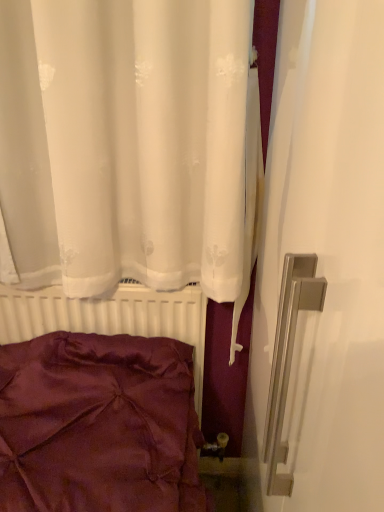
You are a GUI agent. You are given a task and a screenshot of the screen. Output one action in this format:
    pyautogui.click(x=<x>, y=<y>)
    Task: Click on the satin burgundy pillow at lower left
    The height and width of the screenshot is (512, 384).
    Given the screenshot: What is the action you would take?
    pyautogui.click(x=98, y=425)

Describe the element at coordinates (98, 425) in the screenshot. Image resolution: width=384 pixels, height=512 pixels. I see `satin burgundy pillow at lower left` at that location.

In order to face white matte radiator at lower left, should I rotate leftwards or rightwards?

It's best to rotate left around 10.101 degrees.

At what (x,y) coordinates should I click in order to perform the action: click on white matte radiator at lower left. Please return your answer as a coordinate pair (x, y). Image resolution: width=384 pixels, height=512 pixels. Looking at the image, I should click on [x=110, y=317].

What do you see at coordinates (110, 317) in the screenshot? Image resolution: width=384 pixels, height=512 pixels. I see `white matte radiator at lower left` at bounding box center [110, 317].

Image resolution: width=384 pixels, height=512 pixels. I want to click on satin burgundy pillow at lower left, so click(x=98, y=425).

Which is more to the right, white matte radiator at lower left or satin burgundy pillow at lower left?

Positioned to the right is white matte radiator at lower left.

Does white matte radiator at lower left lie in front of satin burgundy pillow at lower left?

No, white matte radiator at lower left is behind satin burgundy pillow at lower left.

Is point (124, 288) farther from camera compared to point (1, 393)?

Yes, it is.

From the image's perspective, is white matte radiator at lower left positioned above or below satin burgundy pillow at lower left?

From the image's perspective, white matte radiator at lower left appears below satin burgundy pillow at lower left.

From a real-world perspective, who is located higher, white matte radiator at lower left or satin burgundy pillow at lower left?

satin burgundy pillow at lower left.

Does white matte radiator at lower left have a lesser width compared to satin burgundy pillow at lower left?

Indeed, white matte radiator at lower left has a lesser width compared to satin burgundy pillow at lower left.

Who is taller, white matte radiator at lower left or satin burgundy pillow at lower left?

With more height is white matte radiator at lower left.

Who is smaller, white matte radiator at lower left or satin burgundy pillow at lower left?

Smaller between the two is white matte radiator at lower left.

Is white matte radiator at lower left inside or outside of satin burgundy pillow at lower left?

white matte radiator at lower left cannot be found inside satin burgundy pillow at lower left.

Is white matte radiator at lower left not near satin burgundy pillow at lower left?

white matte radiator at lower left is actually quite close to satin burgundy pillow at lower left.

Could you tell me if white matte radiator at lower left is turned towards satin burgundy pillow at lower left?

Yes, white matte radiator at lower left is aimed at satin burgundy pillow at lower left.

How many degrees apart are the facing directions of white matte radiator at lower left and satin burgundy pillow at lower left?

The facing directions of white matte radiator at lower left and satin burgundy pillow at lower left are 1.26 degrees apart.

Where is `radiator below the satin burgundy pillow at lower left (from a real-world perspective)`? Image resolution: width=384 pixels, height=512 pixels. radiator below the satin burgundy pillow at lower left (from a real-world perspective) is located at coordinates (110, 317).

Is satin burgundy pillow at lower left to the right of white matte radiator at lower left from the viewer's perspective?

No, satin burgundy pillow at lower left is not to the right of white matte radiator at lower left.

Which object is closer to the camera, satin burgundy pillow at lower left or white matte radiator at lower left?

satin burgundy pillow at lower left is closer to the camera.

Considering the positions of points (155, 499) and (197, 404), is point (155, 499) closer to camera compared to point (197, 404)?

Yes, point (155, 499) is closer to viewer.

From the image's perspective, is satin burgundy pillow at lower left above white matte radiator at lower left?

Indeed, from the image's perspective, satin burgundy pillow at lower left is shown above white matte radiator at lower left.

From a real-world perspective, is satin burgundy pillow at lower left physically located above or below white matte radiator at lower left?

Clearly, from a real-world perspective, satin burgundy pillow at lower left is above white matte radiator at lower left.

Does satin burgundy pillow at lower left have a greater width compared to white matte radiator at lower left?

Correct, the width of satin burgundy pillow at lower left exceeds that of white matte radiator at lower left.

Considering the sizes of satin burgundy pillow at lower left and white matte radiator at lower left in the image, is satin burgundy pillow at lower left taller or shorter than white matte radiator at lower left?

satin burgundy pillow at lower left is shorter than white matte radiator at lower left.

Which of these two, satin burgundy pillow at lower left or white matte radiator at lower left, is smaller?

white matte radiator at lower left.

Is satin burgundy pillow at lower left located outside white matte radiator at lower left?

Yes, satin burgundy pillow at lower left is located beyond the bounds of white matte radiator at lower left.

Is satin burgundy pillow at lower left placed right next to white matte radiator at lower left?

They are not placed beside each other.

Is satin burgundy pillow at lower left looking in the opposite direction of white matte radiator at lower left?

Yes, satin burgundy pillow at lower left is facing away from white matte radiator at lower left.

How distant is satin burgundy pillow at lower left from white matte radiator at lower left?

6.13 inches.

Find the location of a particular element. radiator lying on the right of satin burgundy pillow at lower left is located at coordinates (110, 317).

Identify the location of pillow in front of the white matte radiator at lower left. (98, 425).

Find the location of a particular element. Image resolution: width=384 pixels, height=512 pixels. radiator behind the satin burgundy pillow at lower left is located at coordinates (110, 317).